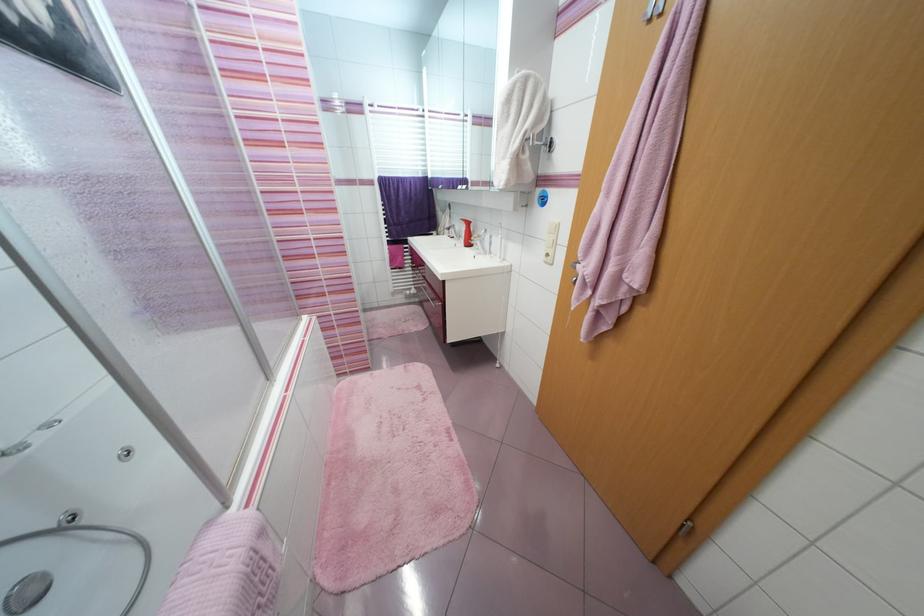
Describe the element at coordinates (580, 270) in the screenshot. I see `the silver door handle` at that location.